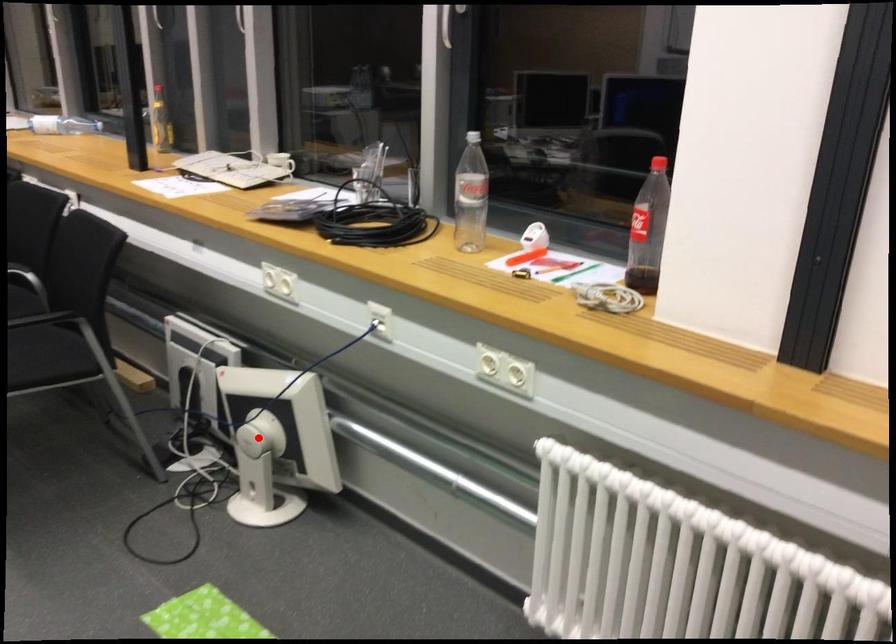
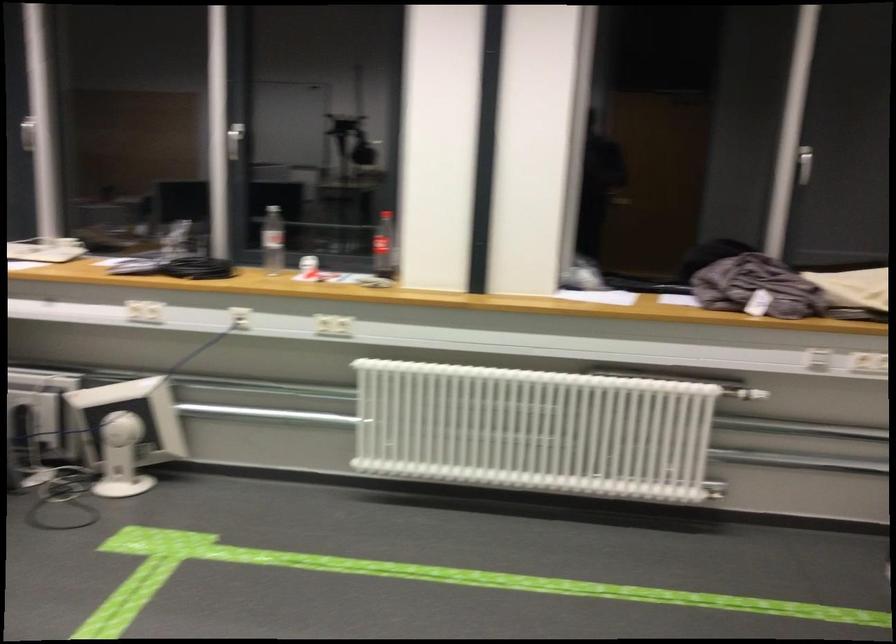
Where in the second image is the point corresponding to the highlighted location from the first image?

(126, 431)